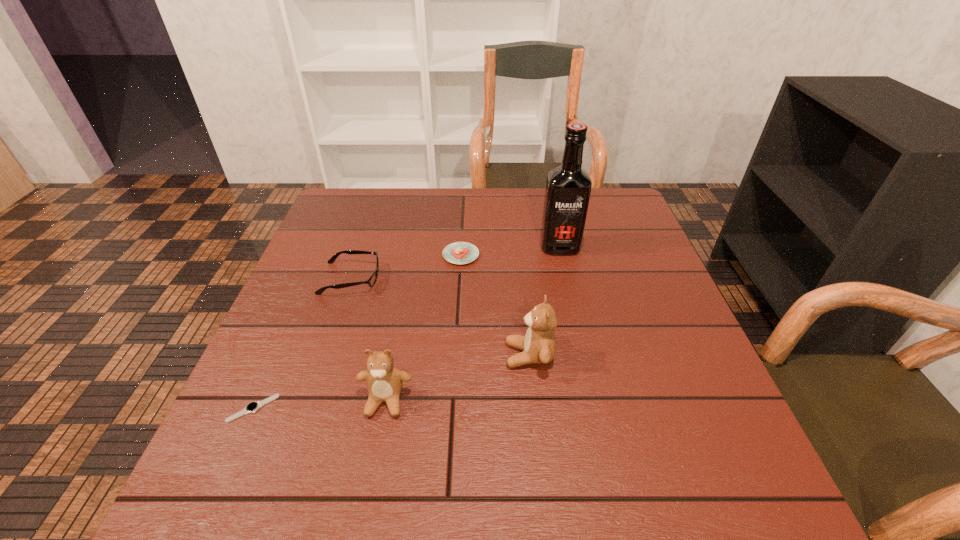
Please point a spot on the right to add another teddy bear. Please provide its 2D coordinates. Your answer should be formatted as a tuple, i.e. [(x, y)], where the tuple contains the x and y coordinates of a point satisfying the conditions above.

[(649, 318)]